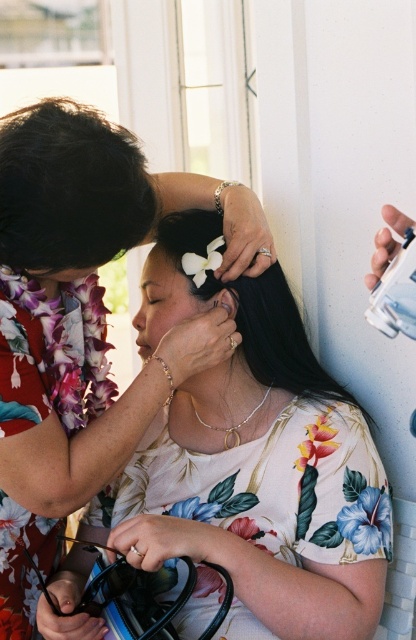
You are standing in the scene and want to place a small gift exactly at the center of the floral fabric at center. According to the coordinates provided, where should you place the gift?

The floral fabric at center is located at point (84, 321), so you should place the gift at those coordinates to center it.

You are a photographer setting up for a portrait. You notice the floral fabric at center and the black silky hair at center in the scene. Which object should you focus on to ensure it appears larger in the final photo?

The floral fabric at center is taller than the black silky hair at center, so focusing on the floral fabric at center would make it appear larger in the photo.